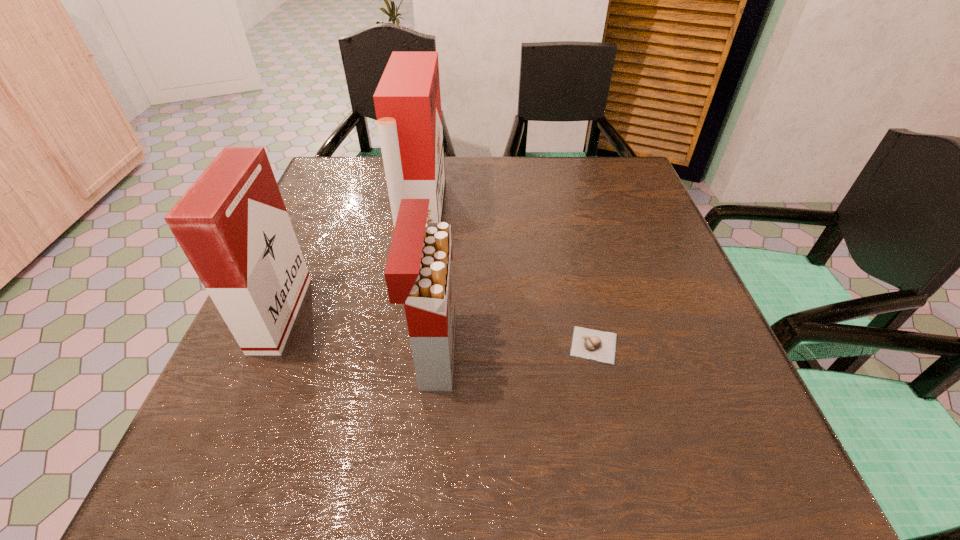
The height and width of the screenshot is (540, 960). What are the coordinates of `vacant space at the near edge` in the screenshot? It's located at (375, 470).

In the image, there is a desktop. At what (x,y) coordinates should I click in order to perform the action: click on free space at the left edge. Please return your answer as a coordinate pair (x, y). Looking at the image, I should click on (358, 243).

In the image, there is a desktop. Identify the location of blank space at the right edge. (610, 250).

The image size is (960, 540). Find the location of `free space at the far left corner of the desktop`. free space at the far left corner of the desktop is located at coordinates (359, 183).

Locate an element on the screen. The height and width of the screenshot is (540, 960). vacant space at the near left corner is located at coordinates (259, 457).

In the image, there is a desktop. At what (x,y) coordinates should I click in order to perform the action: click on free space at the far right corner. Please return your answer as a coordinate pair (x, y). This screenshot has width=960, height=540. Looking at the image, I should click on (599, 160).

At what (x,y) coordinates should I click in order to perform the action: click on vacant region at the near right corner of the desktop. Please return your answer as a coordinate pair (x, y). The height and width of the screenshot is (540, 960). Looking at the image, I should click on (749, 467).

The height and width of the screenshot is (540, 960). Identify the location of free space between the farthest object and the rightmost object. (508, 280).

The height and width of the screenshot is (540, 960). What are the coordinates of `vacant area that lies between the farthest cigarette case and the leftmost cigarette case` in the screenshot? It's located at (351, 265).

Where is `object that can be found as the second closest to the leftmost object`? The height and width of the screenshot is (540, 960). object that can be found as the second closest to the leftmost object is located at coordinates coord(419,273).